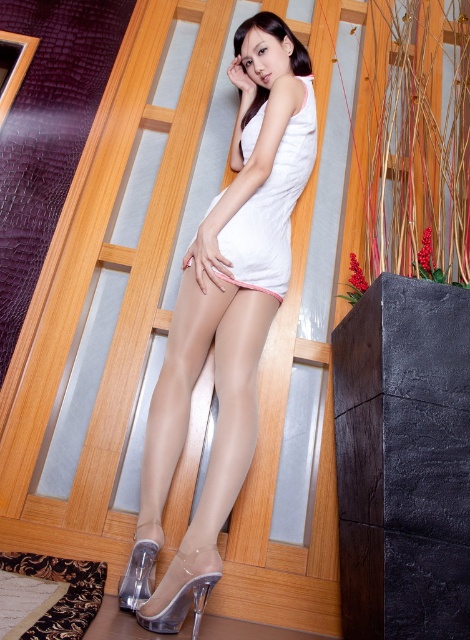
You are a photographer setting up a shoot in this scene. You need to ensure that the matte white dress at center and the pink fabric at center are both visible in the frame. Based on their positions, which object should you focus on first to capture both in the shot?

The matte white dress at center is in front of the pink fabric at center, so focusing on the matte white dress at center first will ensure both are visible in the frame.

You are a photographer setting up a shoot. You need to ensure that the matte white dress at center and the pink fabric at center are both visible in the frame. Based on their sizes, which object should you adjust your camera angle to focus on first to ensure both fit?

The matte white dress at center might be wider than pink fabric at center, so you should focus on positioning the camera to accommodate the wider matte white dress at center first to ensure both fit in the frame.

You are an interior designer analyzing the placement of the matte white dress at center in the image. Based on its coordinates, can you determine if it is positioned near the center of the image?

The 2D location of matte white dress at center is at point (227, 308), which is very close to the center coordinates of the image, so yes, it is positioned near the center of the image.